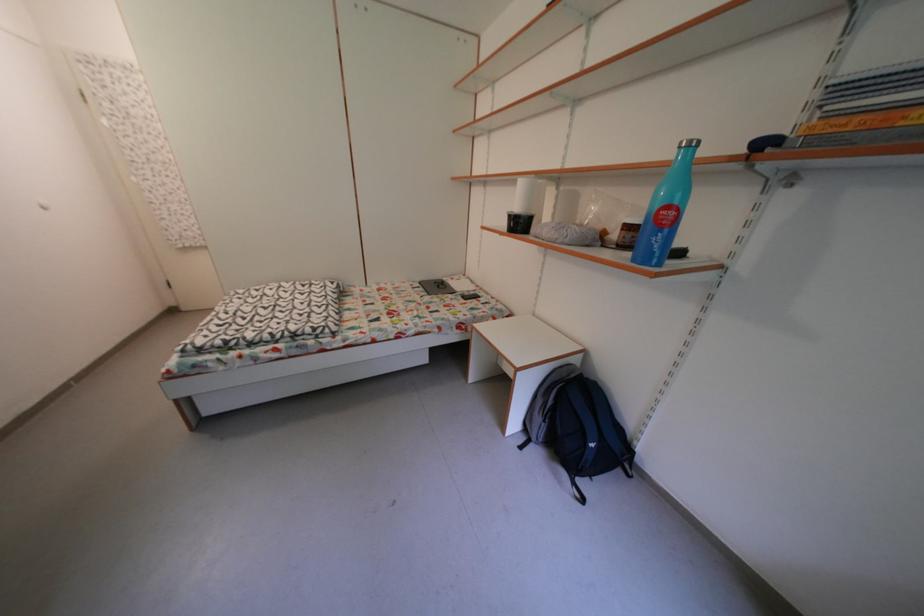
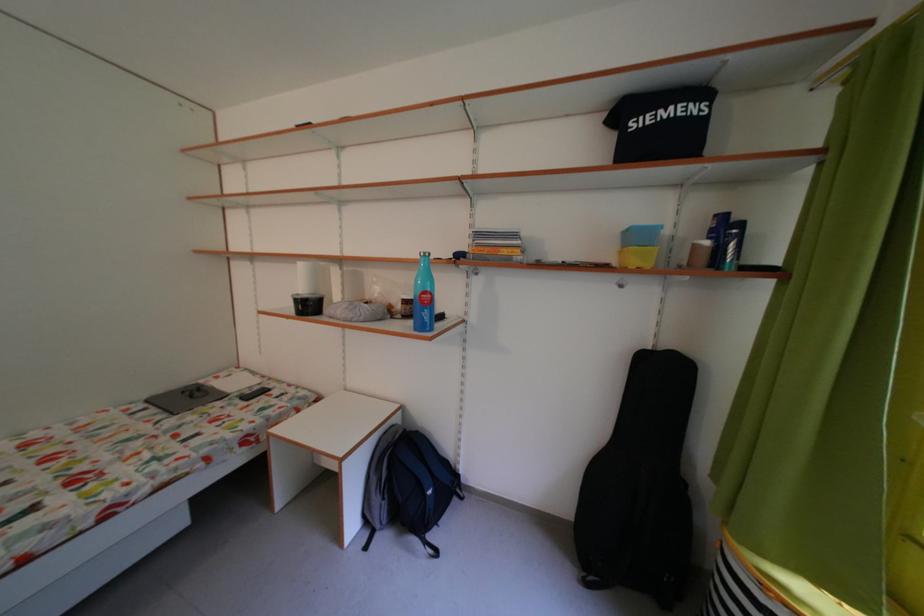
In the second image, find the point that corresponds to (519,222) in the first image.

(306, 306)